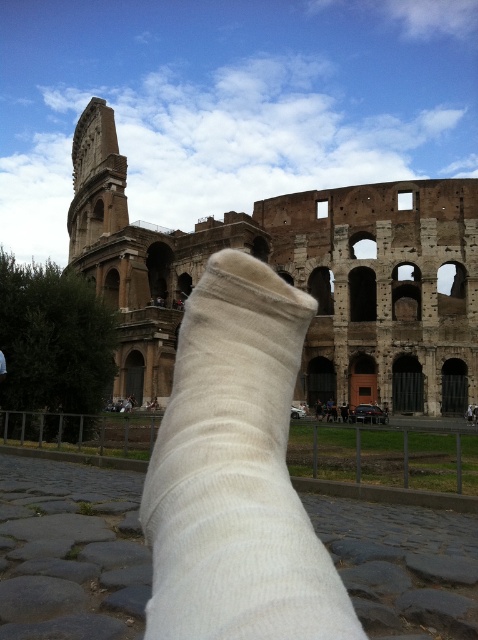
Who is lower down, brown stone amphitheater at center or white cotton sock at center?

Positioned lower is white cotton sock at center.

Which of these two, brown stone amphitheater at center or white cotton sock at center, stands taller?

With more height is brown stone amphitheater at center.

The height and width of the screenshot is (640, 478). What do you see at coordinates (296, 276) in the screenshot? I see `brown stone amphitheater at center` at bounding box center [296, 276].

Locate an element on the screen. This screenshot has width=478, height=640. brown stone amphitheater at center is located at coordinates (296, 276).